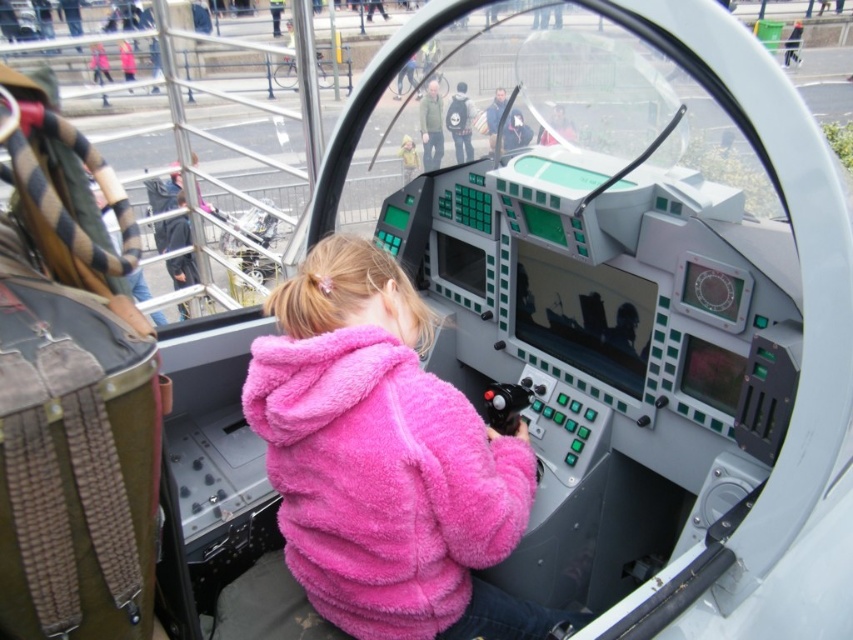
Question: From the image, what is the correct spatial relationship of matte black backpack at center in relation to matte black helmet at upper center?

Choices:
 (A) above
 (B) below

Answer: (A)

Question: Which of the following is the farthest from the observer?

Choices:
 (A) (434, 92)
 (B) (434, 604)
 (C) (567, 120)

Answer: (A)

Question: Among these objects, which one is farthest from the camera?

Choices:
 (A) matte black helmet at upper center
 (B) green matte jacket at upper center

Answer: (B)

Question: Is green matte jacket at upper center below matte black helmet at upper center?

Choices:
 (A) yes
 (B) no

Answer: (B)

Question: Can you confirm if matte black backpack at center is positioned below matte black helmet at upper center?

Choices:
 (A) no
 (B) yes

Answer: (A)

Question: Which object appears farthest from the camera in this image?

Choices:
 (A) matte black helmet at upper center
 (B) fuzzy pink jacket at center

Answer: (A)